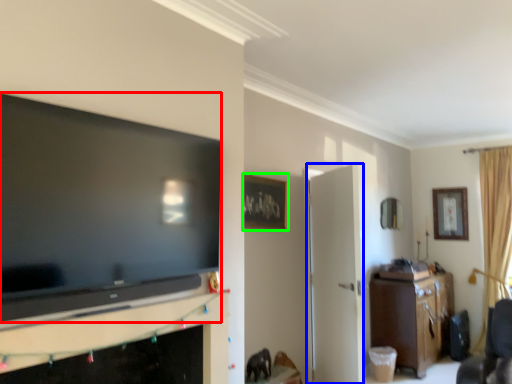
Question: Which object is positioned farthest from television (highlighted by a red box)? Select from door (highlighted by a blue box) and picture frame (highlighted by a green box).

Choices:
 (A) door
 (B) picture frame

Answer: (A)